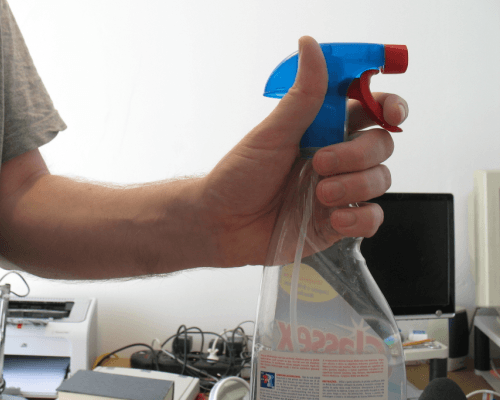
Locate an element on the screen. The width and height of the screenshot is (500, 400). wires is located at coordinates (186, 343), (217, 334), (236, 336), (207, 342), (201, 333), (206, 366), (167, 377), (29, 292), (469, 395).